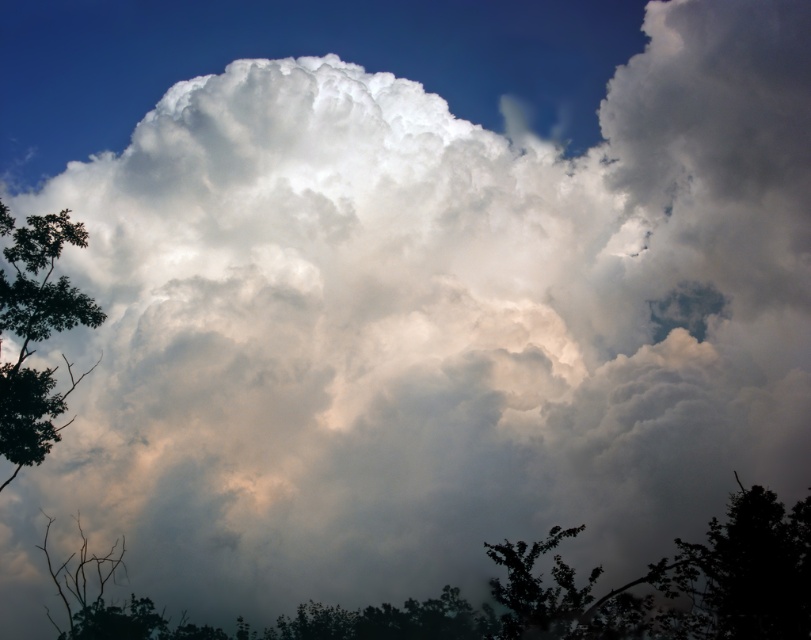
You are standing in a forest and see the green leafy tree at lower center and the green leafy tree at left. Which tree is taller?

The green leafy tree at lower center is taller than the green leafy tree at left.

You are an observer looking at the sky with two green leafy trees in the foreground. Which tree has a wider spread of branches? The green leafy tree at lower center or the green leafy tree at left?

The green leafy tree at lower center has a wider spread of branches than the green leafy tree at left because its width surpasses the latter.